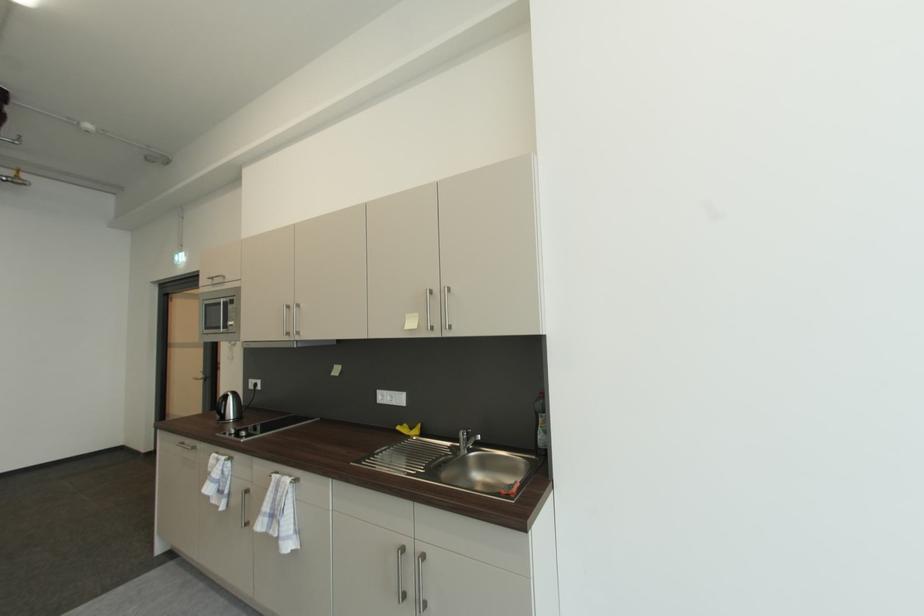
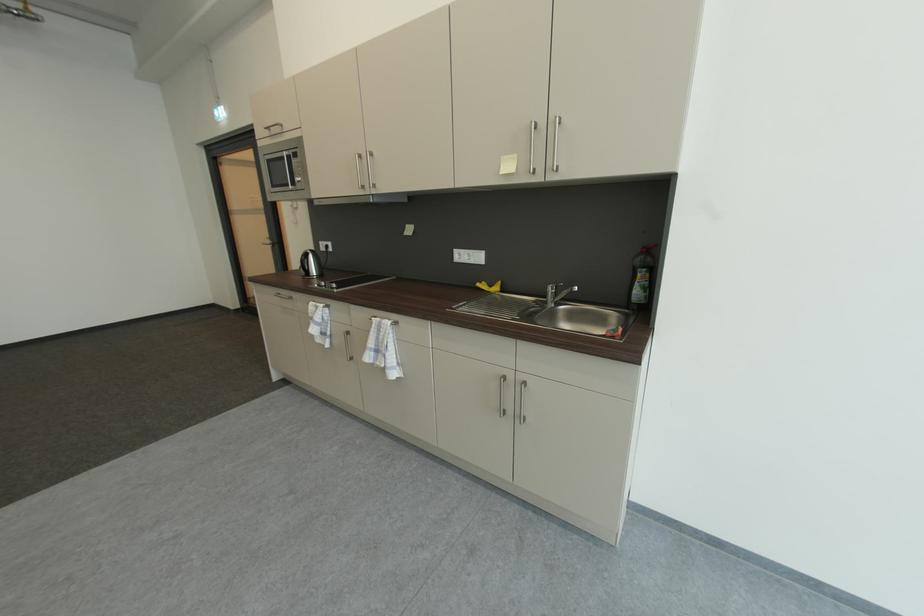
Where in the second image is the point corresponding to [227,402] from the first image?

(310, 259)